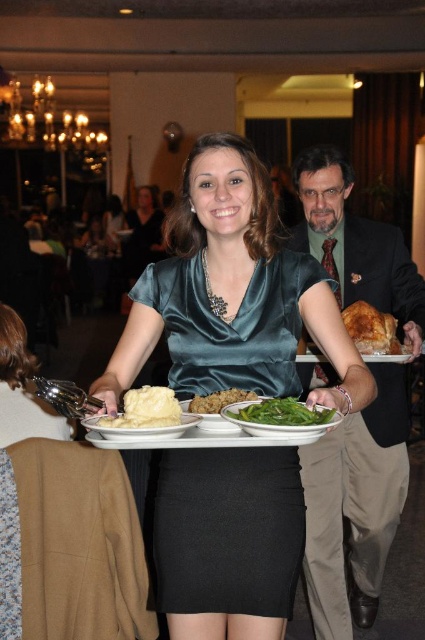
From the picture: Is satin dress at center smaller than golden crispy turkey at right?

No.

Which is more to the right, satin dress at center or golden crispy turkey at right?

From the viewer's perspective, golden crispy turkey at right appears more on the right side.

Find the location of a particular element. The width and height of the screenshot is (425, 640). satin dress at center is located at coordinates (227, 531).

Who is lower down, satin dress at center or white matte plate at center?

satin dress at center

Is satin dress at center closer to the viewer compared to white matte plate at center?

No, satin dress at center is behind white matte plate at center.

Between point (244, 365) and point (121, 428), which one is positioned behind?

Positioned behind is point (244, 365).

Where is `satin dress at center`? The image size is (425, 640). satin dress at center is located at coordinates (227, 531).

Between point (238, 321) and point (155, 392), which one is positioned in front?

Positioned in front is point (155, 392).

Identify the location of satin dress at center. coord(227,531).

The image size is (425, 640). I want to click on satin dress at center, so click(x=227, y=531).

In order to click on satin dress at center in this screenshot , I will do `click(227, 531)`.